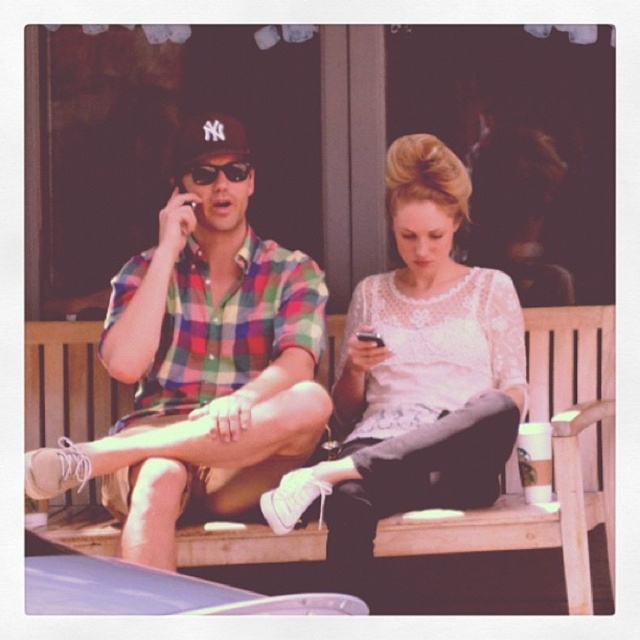
You are standing in front of the wooden bench at center and the black reflective sunglasses at center. Which object is positioned to the left?

The black reflective sunglasses at center are positioned to the left of the wooden bench at center.

What are the coordinates of the wooden bench at center?

The wooden bench at center is located at point (x=554, y=460).

You are a photographer trying to capture a candid shot of the two people on the wooden bench. You want to ensure that both the white lace blouse at center and the black reflective sunglasses at center are clearly visible in the photo. Considering their positions, which object will appear larger in the final photograph?

The white lace blouse at center will appear larger in the photograph because it is much taller than the black reflective sunglasses at center.